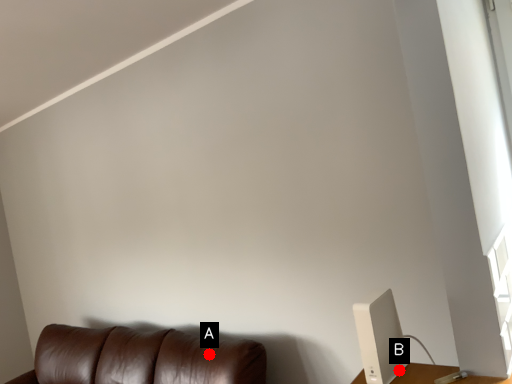
Question: Two points are circled on the image, labeled by A and B beside each circle. Which point is farther to the camera?

Choices:
 (A) A is further
 (B) B is further

Answer: (A)